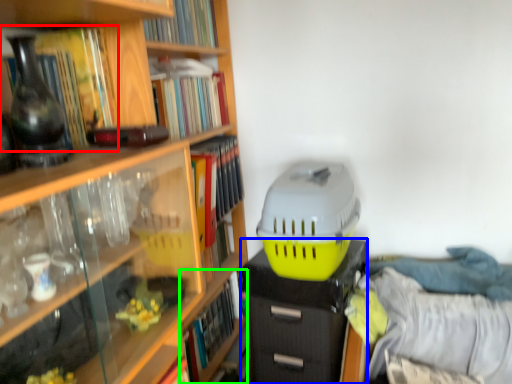
Question: Based on their relative distances, which object is nearer to book (highlighted by a red box)? Choose from file cabinet (highlighted by a blue box) and book (highlighted by a green box).

Choices:
 (A) file cabinet
 (B) book

Answer: (A)